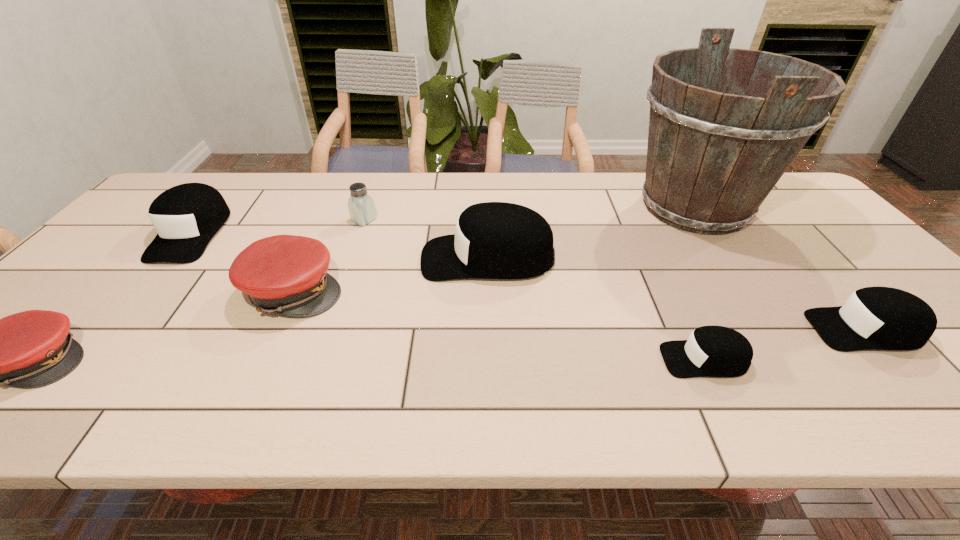
You are a GUI agent. You are given a task and a screenshot of the screen. Output one action in this format:
    pyautogui.click(x=<x>, y=<y>)
    Task: Click on the free region located on the front-facing side of the rightmost black cap
    
    Given the screenshot: What is the action you would take?
    pyautogui.click(x=758, y=329)

This screenshot has height=540, width=960. In order to click on free space located 0.190m on the front-facing side of the fifth cap from left to right in this screenshot , I will do `click(572, 359)`.

Locate an element on the screen. This screenshot has height=540, width=960. free space located on the front-facing side of the fifth cap from left to right is located at coordinates (483, 359).

I want to click on free space located on the front-facing side of the fifth cap from left to right, so 606,359.

Where is `bucket at the far edge`? This screenshot has width=960, height=540. bucket at the far edge is located at coordinates (714, 154).

I want to click on cap that is at the far edge, so click(187, 216).

Locate an element on the screen. This screenshot has height=540, width=960. object at the left edge is located at coordinates (187, 216).

Locate an element on the screen. The width and height of the screenshot is (960, 540). bucket that is at the right edge is located at coordinates (714, 154).

Locate an element on the screen. Image resolution: width=960 pixels, height=540 pixels. cap that is at the right edge is located at coordinates (873, 318).

The height and width of the screenshot is (540, 960). I want to click on object situated at the far left corner, so click(187, 216).